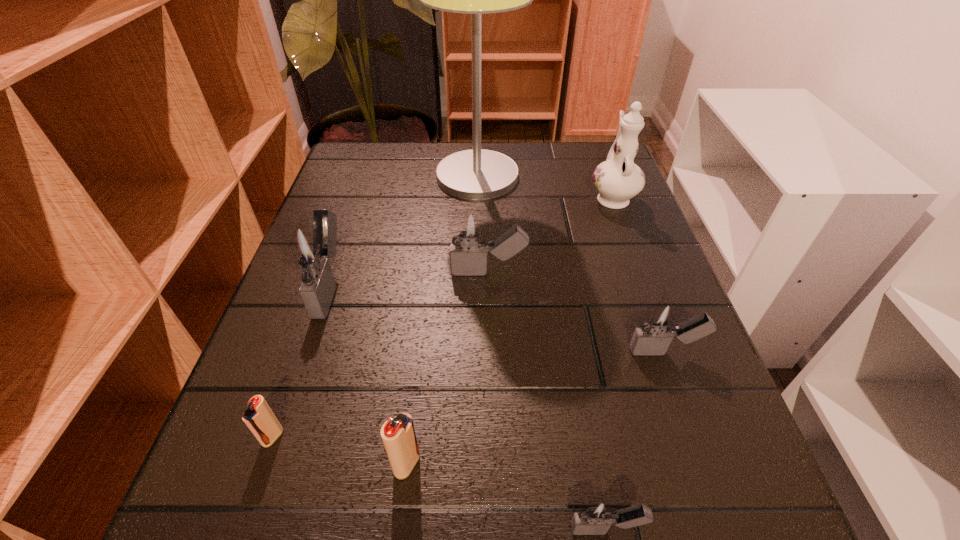
Locate an element on the screen. vacant point located on the back of the smaller red igniter is located at coordinates (336, 253).

Image resolution: width=960 pixels, height=540 pixels. I want to click on table lamp positioned at the far edge, so click(x=476, y=174).

Where is `chinaware that is at the far edge`? The image size is (960, 540). chinaware that is at the far edge is located at coordinates (618, 179).

Where is `chinaware positioned at the right edge`? The width and height of the screenshot is (960, 540). chinaware positioned at the right edge is located at coordinates click(618, 179).

What are the coordinates of `igniter at the right edge` in the screenshot? It's located at (659, 324).

You are a GUI agent. You are given a task and a screenshot of the screen. Output one action in this format:
    pyautogui.click(x=<x>, y=<y>)
    Task: Click on the object that is at the far right corner
    
    Given the screenshot: What is the action you would take?
    pyautogui.click(x=618, y=179)

The width and height of the screenshot is (960, 540). In the image, there is a desktop. What are the coordinates of `vacant space at the far edge` in the screenshot? It's located at (544, 143).

At what (x,y) coordinates should I click in order to perform the action: click on free space at the left edge of the desktop. Please return your answer as a coordinate pair (x, y). The image size is (960, 540). Looking at the image, I should click on (306, 378).

Locate an element on the screen. The image size is (960, 540). free space at the right edge of the desktop is located at coordinates (580, 193).

You are a GUI agent. You are given a task and a screenshot of the screen. Output one action in this format:
    pyautogui.click(x=<x>, y=<y>)
    Task: Click on the vacant area at the far left corner
    
    Given the screenshot: What is the action you would take?
    pyautogui.click(x=358, y=168)